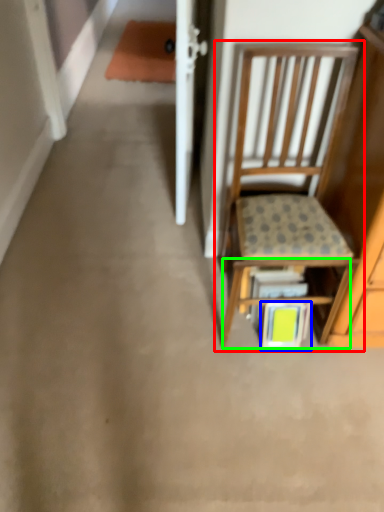
Question: Estimate the real-world distances between objects in this image. Which object is farther from chair (highlighted by a red box), book (highlighted by a blue box) or shelf (highlighted by a green box)?

Choices:
 (A) book
 (B) shelf

Answer: (A)